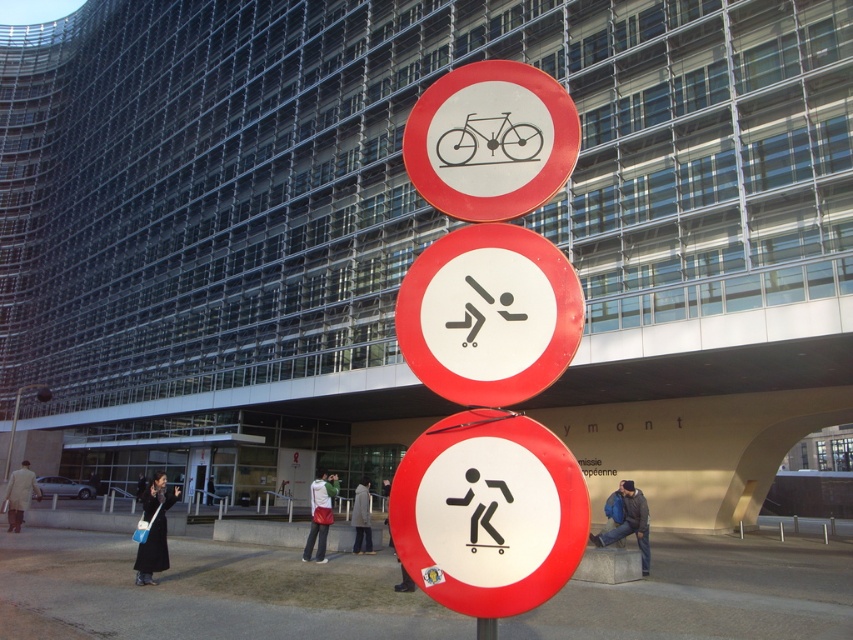
Is dark blue jacket at lower right below light gray coat at center?

No, dark blue jacket at lower right is not below light gray coat at center.

Which is behind, point (608, 508) or point (355, 512)?

The point (355, 512) is behind.

Image resolution: width=853 pixels, height=640 pixels. In order to click on dark blue jacket at lower right in this screenshot , I will do `click(628, 522)`.

Find the location of a particular element. dark blue jacket at lower right is located at coordinates (628, 522).

Is white matte bicycle at upper center smaller than dark blue jacket at lower right?

Indeed, white matte bicycle at upper center has a smaller size compared to dark blue jacket at lower right.

Can you confirm if white matte bicycle at upper center is bigger than dark blue jacket at lower right?

No.

Locate an element on the screen. The image size is (853, 640). white matte bicycle at upper center is located at coordinates (490, 140).

Is the position of dark blue jacket at lower right less distant than that of light beige coat at lower left?

Yes, it is.

From the picture: Between dark blue jacket at lower right and light beige coat at lower left, which one has more height?

light beige coat at lower left

The width and height of the screenshot is (853, 640). Find the location of `dark blue jacket at lower right`. dark blue jacket at lower right is located at coordinates (628, 522).